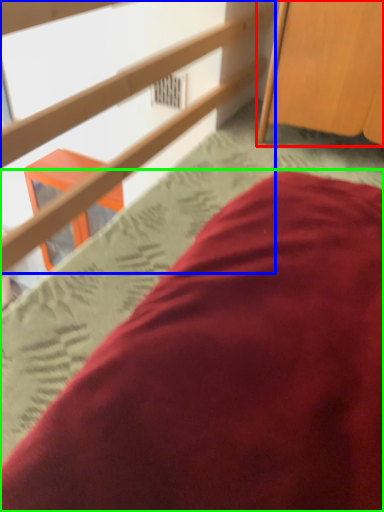
Question: Based on their relative distances, which object is farther from furniture (highlighted by a red box)? Choose from rail (highlighted by a blue box) and bed (highlighted by a green box).

Choices:
 (A) rail
 (B) bed

Answer: (B)